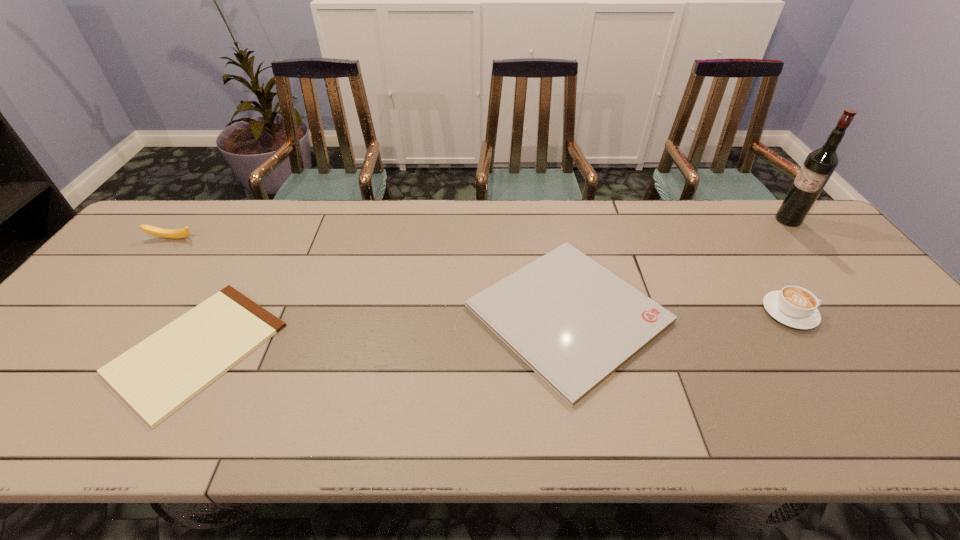
Locate an element on the screen. the farthest object is located at coordinates (818, 167).

Find the location of a particular element. Image resolution: width=960 pixels, height=540 pixels. the rightmost object is located at coordinates (818, 167).

You are a GUI agent. You are given a task and a screenshot of the screen. Output one action in this format:
    pyautogui.click(x=<x>, y=<y>)
    Task: Click on the banana
    
    Given the screenshot: What is the action you would take?
    pyautogui.click(x=160, y=232)

Identify the location of cappuccino. (794, 306).

Where is `the third object from right to left`? The height and width of the screenshot is (540, 960). the third object from right to left is located at coordinates (573, 322).

This screenshot has height=540, width=960. Identify the location of the right clipboard. (573, 322).

In order to click on the left clipboard in this screenshot , I will do `click(156, 377)`.

The height and width of the screenshot is (540, 960). I want to click on the shorter clipboard, so click(156, 377).

Locate an element on the screen. This screenshot has width=960, height=540. blank space located on the front and back of the farthest object is located at coordinates (722, 220).

The height and width of the screenshot is (540, 960). What are the coordinates of `vacant space located on the front and back of the farthest object` in the screenshot? It's located at (716, 220).